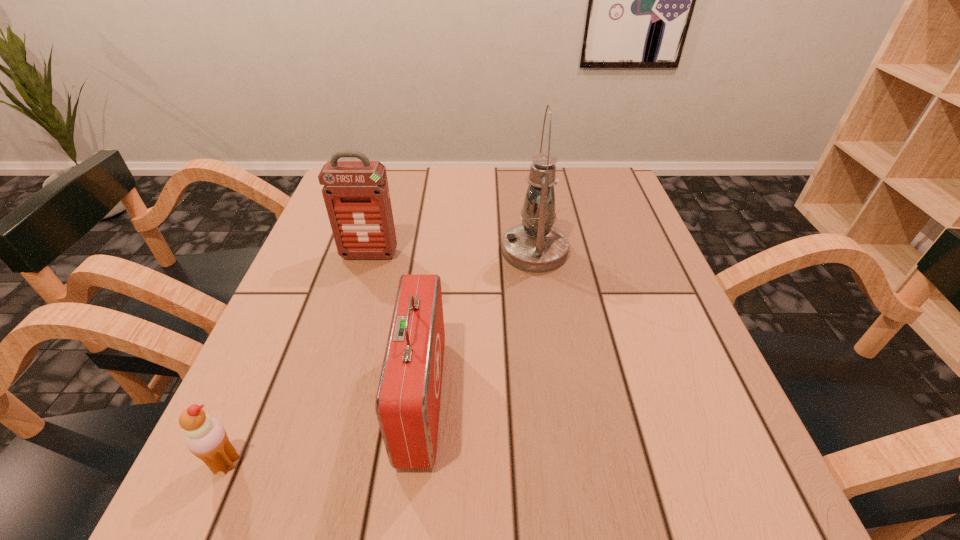
Where is `vacant area that satisfies the following two spatial constraints: 1. on the side of the nearer first-aid kit with the first aid cross symbol; 2. at the front with a straw on the icecream`? This screenshot has height=540, width=960. vacant area that satisfies the following two spatial constraints: 1. on the side of the nearer first-aid kit with the first aid cross symbol; 2. at the front with a straw on the icecream is located at coordinates (415, 462).